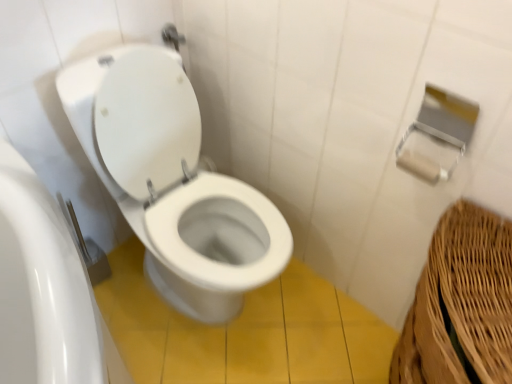
Question: Is point (162, 132) positioned closer to the camera than point (429, 175)?

Choices:
 (A) closer
 (B) farther

Answer: (B)

Question: In terms of height, does white glossy toilet at center look taller or shorter compared to white matte toilet paper at upper right?

Choices:
 (A) short
 (B) tall

Answer: (B)

Question: Considering the relative positions of white glossy toilet at center and white matte toilet paper at upper right in the image provided, is white glossy toilet at center to the left or to the right of white matte toilet paper at upper right?

Choices:
 (A) left
 (B) right

Answer: (A)

Question: From a real-world perspective, is white matte toilet paper at upper right above or below white glossy toilet at center?

Choices:
 (A) below
 (B) above

Answer: (B)

Question: Looking at the image, does white matte toilet paper at upper right seem bigger or smaller compared to white glossy toilet at center?

Choices:
 (A) small
 (B) big

Answer: (A)

Question: From the image's perspective, is white matte toilet paper at upper right positioned above or below white glossy toilet at center?

Choices:
 (A) below
 (B) above

Answer: (B)

Question: Is point (442, 172) positioned closer to the camera than point (262, 251)?

Choices:
 (A) closer
 (B) farther

Answer: (A)